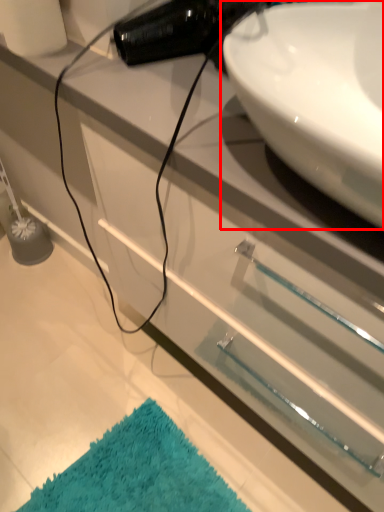
Question: Where is sink (annotated by the red box) located in relation to bath mat in the image?

Choices:
 (A) left
 (B) right

Answer: (B)